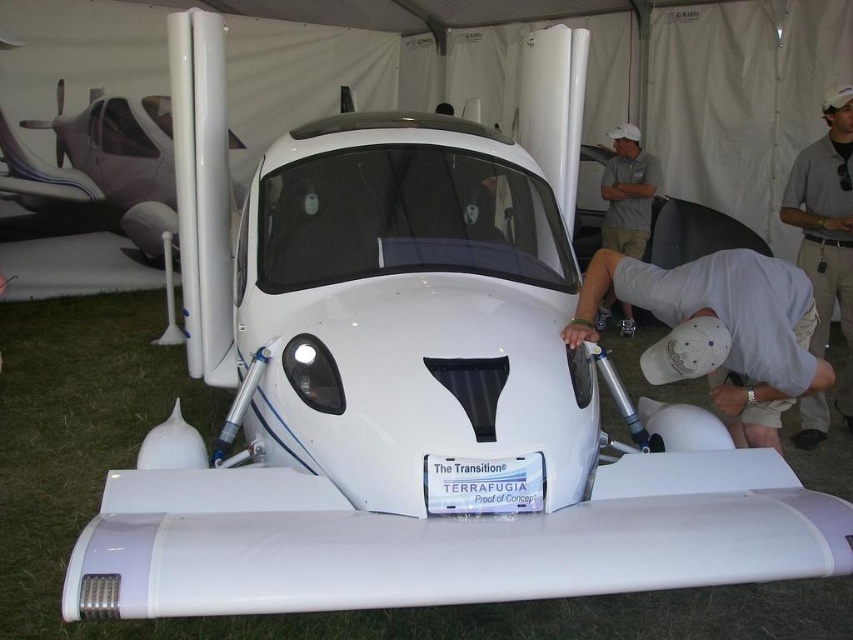
Question: Estimate the real-world distances between objects in this image. Which object is farther from the white glossy airplane at upper left?

Choices:
 (A) white matte helmet at lower center
 (B) white cotton shirt at upper center

Answer: (A)

Question: Can you confirm if white matte helmet at lower center is positioned to the right of gray shirt at upper right?

Choices:
 (A) yes
 (B) no

Answer: (B)

Question: Considering the real-world distances, which object is closest to the white glossy airplane at upper left?

Choices:
 (A) white cotton shirt at upper center
 (B) white matte helmet at lower center

Answer: (A)

Question: Does gray shirt at upper right appear on the left side of white cotton shirt at upper center?

Choices:
 (A) yes
 (B) no

Answer: (B)

Question: Can you confirm if white matte helmet at lower center is bigger than white glossy airplane at upper left?

Choices:
 (A) no
 (B) yes

Answer: (A)

Question: Which of the following is the closest to the observer?

Choices:
 (A) (653, 307)
 (B) (793, 170)
 (C) (637, 195)
 (D) (149, 202)

Answer: (A)